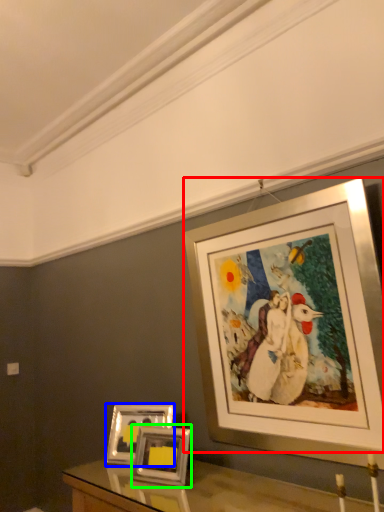
Question: Which object is positioned closest to picture frame (highlighted by a red box)? Select from picture frame (highlighted by a blue box) and picture frame (highlighted by a green box).

Choices:
 (A) picture frame
 (B) picture frame

Answer: (B)